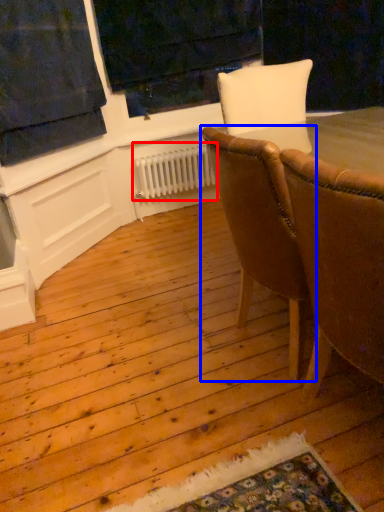
Question: Which object is further to the camera taking this photo, radiator (highlighted by a red box) or chair (highlighted by a blue box)?

Choices:
 (A) radiator
 (B) chair

Answer: (A)